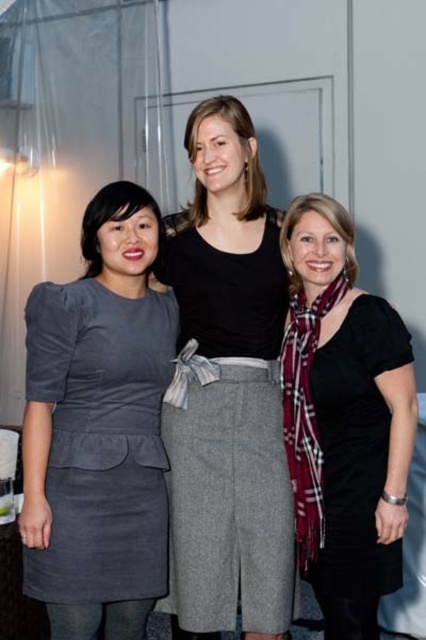
You are standing at the origin point of the coordinate system. You want to walk towards the black cotton shirt at center. In which direction should you move?

The black cotton shirt at center is located at point 0.613 on the x axis and 0.538 on the y axis. Since you are at the origin, you should move in the positive x and positive y direction to reach it.

You are organizing a clothing donation drive and need to determine which item takes up more space in a donation bin. Looking at the black cotton shirt at center and the plaid scarf at center in the image, which one is wider?

The black cotton shirt at center is wider than the plaid scarf at center, so it takes up more space in the donation bin.